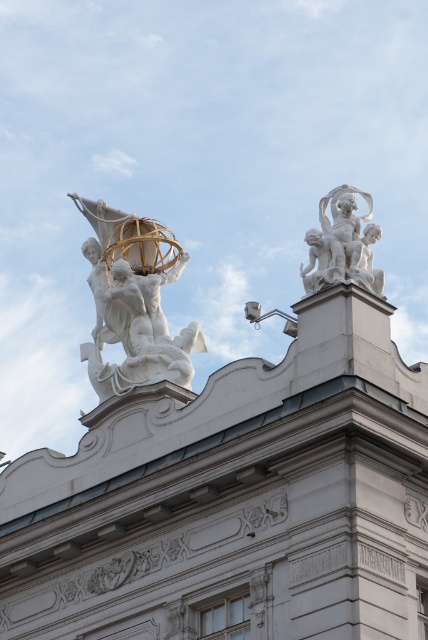
You are standing at the base of the building and want to take a photo of the white marble statue at upper left. If your camera can focus on objects up to 200 feet away, will you be able to capture a clear image of the statue?

The white marble statue at upper left is 223.67 feet away from the viewer. Since this distance exceeds the camera maximum focus range of 200 feet, the statue will be out of focus and the photo will not be clear.

Based on the photo, you are an architect assessing the building facade. You need to determine which of the two groups of statues, the white marble statue at upper left or the white marble cherubs at upper right, requires a taller base to ensure stability. Based on their heights, which one needs a taller base?

The white marble cherubs at upper right are taller than the white marble statue at upper left, so they would require a taller base to ensure stability.

You are an architect analyzing the building facade. You need to locate the white marble statue at upper left. What are its coordinates?

The white marble statue at upper left is located at coordinates point (133, 301).